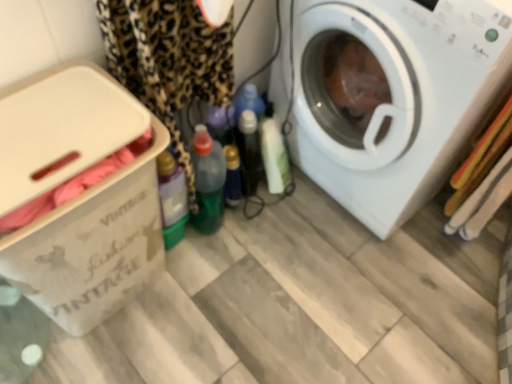
Question: Is point (380, 125) positioned closer to the camera than point (175, 1)?

Choices:
 (A) closer
 (B) farther

Answer: (B)

Question: In terms of width, does white plastic washing machine at right look wider or thinner when compared to leopard print fabric at left?

Choices:
 (A) wide
 (B) thin

Answer: (A)

Question: Which object is positioned farthest from the translucent plastic bottle at center, the 1th bottle positioned from the right?

Choices:
 (A) white plastic washing machine at right
 (B) beige cardboard box at left
 (C) leopard print fabric at left
 (D) green plastic bottle at center, placed as the 2th bottle when sorted from right to left

Answer: (B)

Question: Estimate the real-world distances between objects in this image. Which object is farther from the beige cardboard box at left?

Choices:
 (A) translucent plastic bottle at center, the 1th bottle positioned from the right
 (B) green plastic bottle at center, placed as the 2th bottle when sorted from right to left
 (C) white plastic washing machine at right
 (D) leopard print fabric at left

Answer: (C)